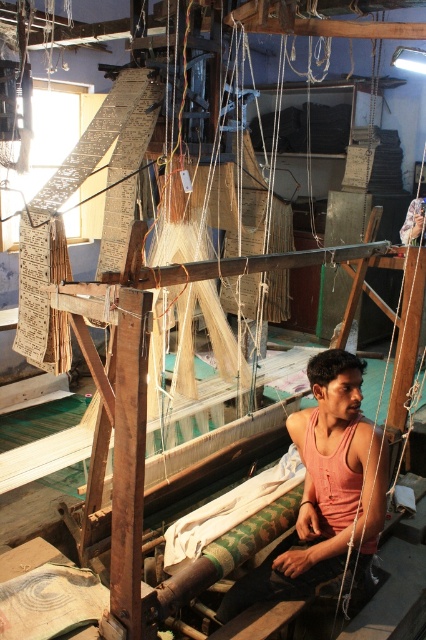
In the weaving workshop scene, there is a pink cotton tank top at center and a green woven cloth at center. Which object is positioned to the right of the other?

The pink cotton tank top at center is to the right of the green woven cloth at center.

You are a visitor in the weaving workshop and want to locate the pink cotton tank top at center. According to the coordinates provided, where would you find it?

The pink cotton tank top at center is located at coordinates point [325,490].